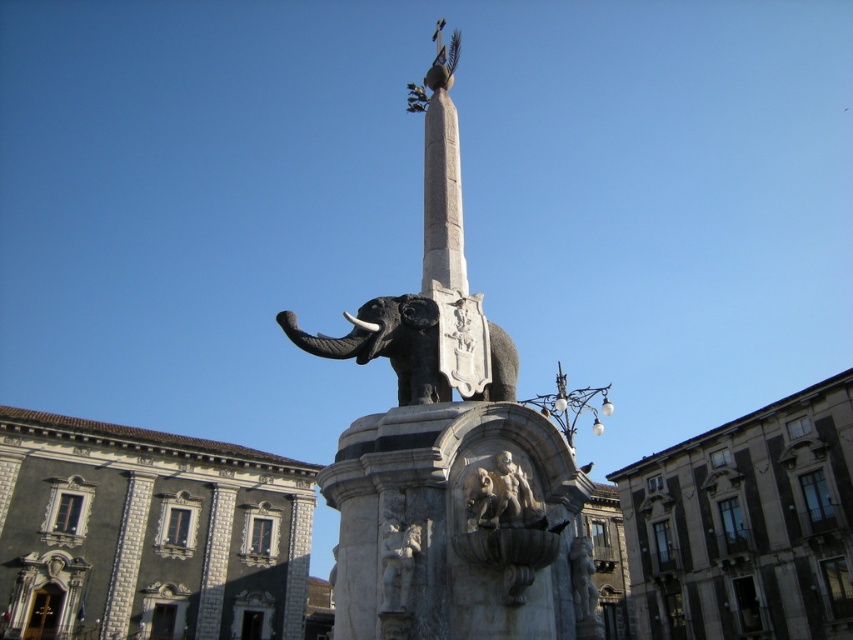
Question: Does gray stone fountain at center appear over polished stone figures at center?

Choices:
 (A) yes
 (B) no

Answer: (B)

Question: Estimate the real-world distances between objects in this image. Which object is farther from the polished stone elephant at center?

Choices:
 (A) polished stone figures at center
 (B) polished bronze elephant at center
 (C) gray stone fountain at center
 (D) white marble cherub at center

Answer: (C)

Question: Which point appears closest to the camera in this image?

Choices:
 (A) (496, 502)
 (B) (380, 579)
 (C) (410, 344)
 (D) (397, 579)

Answer: (D)

Question: Which object is positioned farthest from the polished stone elephant at center?

Choices:
 (A) polished bronze elephant at center
 (B) polished stone figures at center
 (C) white marble cherub at center
 (D) gray stone fountain at center

Answer: (D)

Question: Does polished stone elephant at center have a lesser width compared to polished stone figures at center?

Choices:
 (A) yes
 (B) no

Answer: (B)

Question: Can you confirm if polished bronze elephant at center is positioned to the left of white marble cherub at center?

Choices:
 (A) yes
 (B) no

Answer: (A)